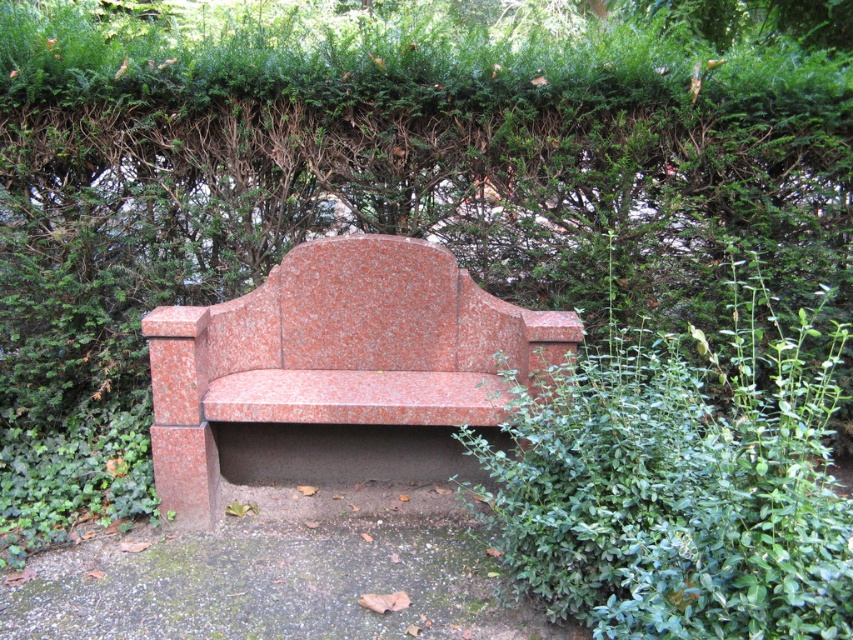
The image size is (853, 640). Identify the location of green leafy bush at lower right. (682, 483).

Can you confirm if green leafy bush at lower right is taller than granite bench at center?

Yes.

Who is more distant from viewer, (x=785, y=474) or (x=352, y=508)?

Point (x=352, y=508)

Identify the location of green leafy bush at lower right. The height and width of the screenshot is (640, 853). (682, 483).